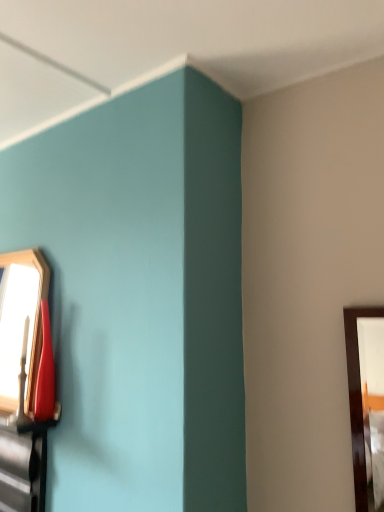
Image resolution: width=384 pixels, height=512 pixels. Describe the element at coordinates (16, 326) in the screenshot. I see `matte wooden mirror at left` at that location.

This screenshot has height=512, width=384. Identify the location of matte wooden mirror at left. (16, 326).

Where is `matte wooden mirror at left`? Image resolution: width=384 pixels, height=512 pixels. matte wooden mirror at left is located at coordinates (16, 326).